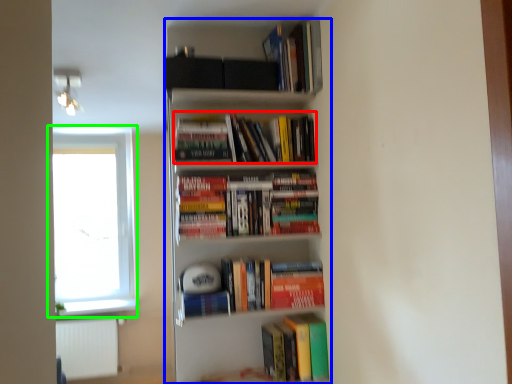
Question: Which object is the farthest from book (highlighted by a red box)? Choose among these: bookcase (highlighted by a blue box) or window (highlighted by a green box).

Choices:
 (A) bookcase
 (B) window

Answer: (B)